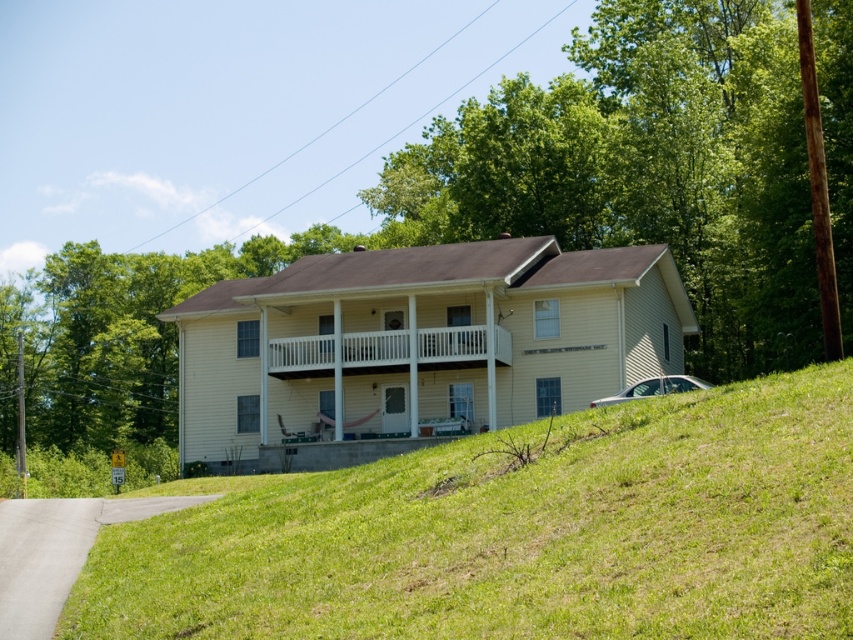
You are a landscape architect designing a garden path that needs to be 10 meters wide. You have to choose between placing it on the green grassy hillside at lower center or the white wooden porch at center. Based on their widths, which location can accommodate the path?

The green grassy hillside at lower center has a larger width than the white wooden porch at center, so the garden path should be placed on the green grassy hillside at lower center to accommodate its 10 meter width.

You are standing at point A located at coordinates (518, 532) in the image. What is the terrain like at your current location?

The terrain at point A located at coordinates (518, 532) is green grassy hillside at lower center.